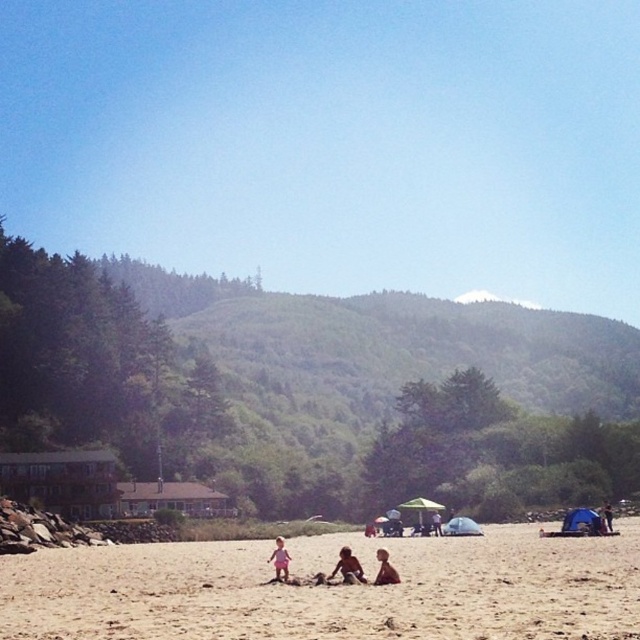
Does beige sandy beach at center appear on the left side of pink fabric at center?

In fact, beige sandy beach at center is to the right of pink fabric at center.

Does beige sandy beach at center appear under pink fabric at center?

Indeed, beige sandy beach at center is positioned under pink fabric at center.

You are a GUI agent. You are given a task and a screenshot of the screen. Output one action in this format:
    pyautogui.click(x=<x>, y=<y>)
    Task: Click on the beige sandy beach at center
    The height and width of the screenshot is (640, 640).
    Given the screenshot: What is the action you would take?
    pyautogui.click(x=330, y=589)

Find the location of a particular element. The width and height of the screenshot is (640, 640). beige sandy beach at center is located at coordinates (330, 589).

The height and width of the screenshot is (640, 640). Find the location of `beige sandy beach at center`. beige sandy beach at center is located at coordinates (330, 589).

From the picture: Measure the distance between point [531,541] and camera.

A distance of 62.94 meters exists between point [531,541] and camera.

Where is `beige sandy beach at center`? beige sandy beach at center is located at coordinates click(x=330, y=589).

Looking at this image, is smooth sand at center smaller than light brown skin at center?

Indeed, smooth sand at center has a smaller size compared to light brown skin at center.

Measure the distance between point (342, 547) and camera.

Point (342, 547) is 44.05 meters from camera.

Which is in front, point (349, 579) or point (380, 579)?

Point (380, 579) is more forward.

Identify the location of smooth sand at center. (348, 566).